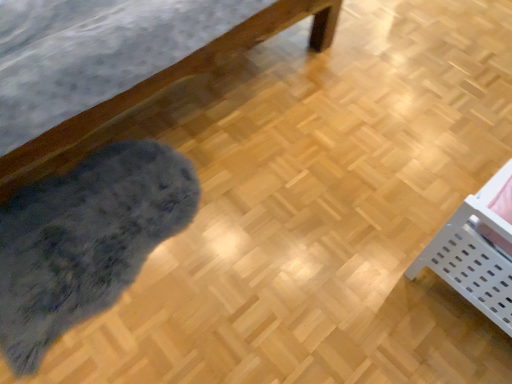
Question: Is fuzzy gray mat at lower left positioned far away from white plastic basket at lower right?

Choices:
 (A) yes
 (B) no

Answer: (A)

Question: Can you confirm if fuzzy gray mat at lower left is wider than white plastic basket at lower right?

Choices:
 (A) yes
 (B) no

Answer: (A)

Question: Is fuzzy gray mat at lower left bigger than white plastic basket at lower right?

Choices:
 (A) yes
 (B) no

Answer: (B)

Question: Is fuzzy gray mat at lower left thinner than white plastic basket at lower right?

Choices:
 (A) yes
 (B) no

Answer: (B)

Question: Is fuzzy gray mat at lower left at the left side of white plastic basket at lower right?

Choices:
 (A) no
 (B) yes

Answer: (B)

Question: Does fuzzy gray mat at lower left appear on the right side of white plastic basket at lower right?

Choices:
 (A) yes
 (B) no

Answer: (B)

Question: Does white plastic basket at lower right have a larger size compared to fuzzy gray mat at lower left?

Choices:
 (A) yes
 (B) no

Answer: (A)

Question: Is white plastic basket at lower right further to camera compared to fuzzy gray mat at lower left?

Choices:
 (A) yes
 (B) no

Answer: (B)

Question: Is white plastic basket at lower right far from fuzzy gray mat at lower left?

Choices:
 (A) no
 (B) yes

Answer: (B)

Question: Is white plastic basket at lower right positioned in front of fuzzy gray mat at lower left?

Choices:
 (A) no
 (B) yes

Answer: (B)

Question: Is fuzzy gray mat at lower left completely or partially inside white plastic basket at lower right?

Choices:
 (A) no
 (B) yes

Answer: (A)

Question: Considering the relative positions of white plastic basket at lower right and fuzzy gray mat at lower left in the image provided, is white plastic basket at lower right to the right of fuzzy gray mat at lower left from the viewer's perspective?

Choices:
 (A) yes
 (B) no

Answer: (A)

Question: Is white plastic basket at lower right in front of or behind fuzzy gray mat at lower left in the image?

Choices:
 (A) front
 (B) behind

Answer: (A)